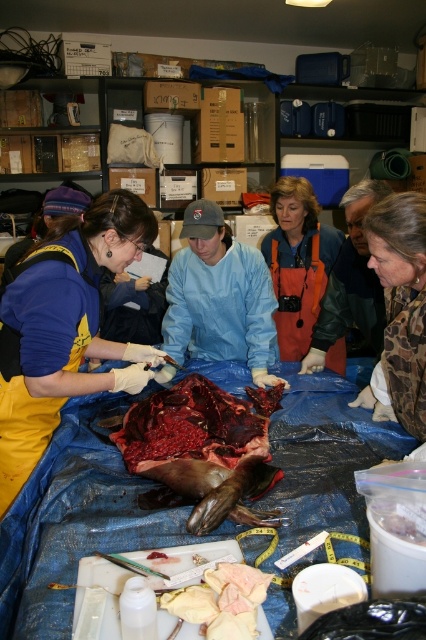
Question: Can you confirm if blue plastic table at center is bigger than orange waterproof apron at center?

Choices:
 (A) yes
 (B) no

Answer: (A)

Question: Is blue plastic table at center positioned in front of blue/yellow jacket at left?

Choices:
 (A) yes
 (B) no

Answer: (A)

Question: Which of the following is the closest to the observer?

Choices:
 (A) blue/yellow jacket at left
 (B) orange waterproof apron at center
 (C) blue plastic table at center

Answer: (C)

Question: Which point is closer to the camera?

Choices:
 (A) blue/yellow jacket at left
 (B) blue plastic table at center
 (C) camouflage fabric jacket at lower right

Answer: (B)

Question: Is blue/yellow jacket at left to the right of dark red flesh at center from the viewer's perspective?

Choices:
 (A) no
 (B) yes

Answer: (A)

Question: Which of the following is the closest to the observer?

Choices:
 (A) (158, 428)
 (B) (278, 301)
 (C) (23, 435)

Answer: (C)